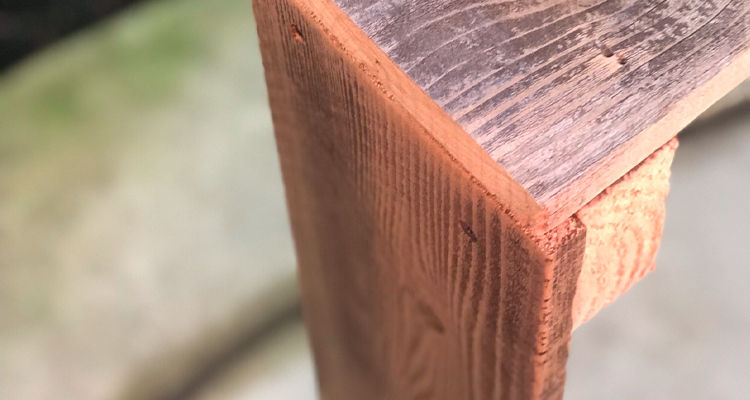
Identify the location of background blurry wooden floor to left of foreground image. The width and height of the screenshot is (750, 400). (69, 178).